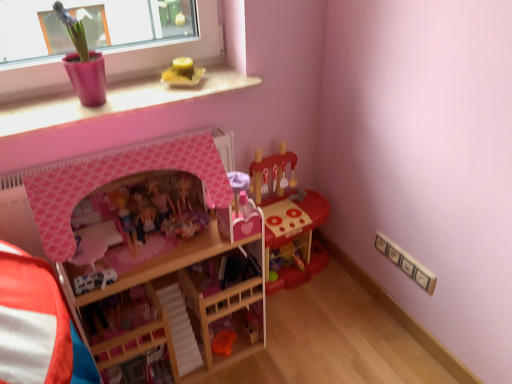
Question: Is the position of pink matte dollhouse at center, which is the 3th toy from right to left, more distant than that of white plastic car at center, the 2th toy in the left-to-right sequence?

Choices:
 (A) yes
 (B) no

Answer: (A)

Question: Is pink matte dollhouse at center, which is the 3th toy from right to left, to the left of white plastic car at center, the fourth toy positioned from the right, from the viewer's perspective?

Choices:
 (A) yes
 (B) no

Answer: (B)

Question: Does pink matte dollhouse at center, which is the 3th toy from right to left, turn towards white plastic car at center, the fourth toy positioned from the right?

Choices:
 (A) yes
 (B) no

Answer: (B)

Question: Can you see pink matte dollhouse at center, which is the 3th toy from right to left, touching white plastic car at center, the 2th toy in the left-to-right sequence?

Choices:
 (A) yes
 (B) no

Answer: (B)

Question: From the image's perspective, is pink matte dollhouse at center, which is the 3th toy from right to left, above white plastic car at center, the fourth toy positioned from the right?

Choices:
 (A) yes
 (B) no

Answer: (A)

Question: Is wooden bunk bed at center situated inside pink matte dollhouse at center, which is the 3th toy in left-to-right order, or outside?

Choices:
 (A) outside
 (B) inside

Answer: (A)

Question: Relative to pink matte dollhouse at center, which is the 3th toy from right to left, is wooden bunk bed at center in front or behind?

Choices:
 (A) behind
 (B) front

Answer: (B)

Question: Considering the positions of wooden bunk bed at center and pink matte dollhouse at center, which is the 3th toy in left-to-right order, in the image, is wooden bunk bed at center bigger or smaller than pink matte dollhouse at center, which is the 3th toy in left-to-right order,?

Choices:
 (A) big
 (B) small

Answer: (A)

Question: From the image's perspective, is wooden bunk bed at center above or below pink matte dollhouse at center, which is the 3th toy in left-to-right order?

Choices:
 (A) above
 (B) below

Answer: (B)

Question: Looking at the image, does white plastic car at center, the 2th toy in the left-to-right sequence, seem bigger or smaller compared to wooden bunk bed at center?

Choices:
 (A) small
 (B) big

Answer: (A)

Question: Visually, is white plastic car at center, the fourth toy positioned from the right, positioned to the left or to the right of wooden bunk bed at center?

Choices:
 (A) left
 (B) right

Answer: (A)

Question: Is point (99, 286) closer or farther from the camera than point (214, 233)?

Choices:
 (A) closer
 (B) farther

Answer: (A)

Question: From the image's perspective, is white plastic car at center, the fourth toy positioned from the right, above or below wooden bunk bed at center?

Choices:
 (A) below
 (B) above

Answer: (B)

Question: In terms of height, does yellow wax candle at upper center, positioned as the 2th toy in right-to-left order, look taller or shorter compared to pink matte dollhouse at center, which is the 3th toy in left-to-right order?

Choices:
 (A) short
 (B) tall

Answer: (A)

Question: Is yellow wax candle at upper center, the fourth toy from the left, spatially inside pink matte dollhouse at center, which is the 3th toy from right to left, or outside of it?

Choices:
 (A) outside
 (B) inside

Answer: (A)